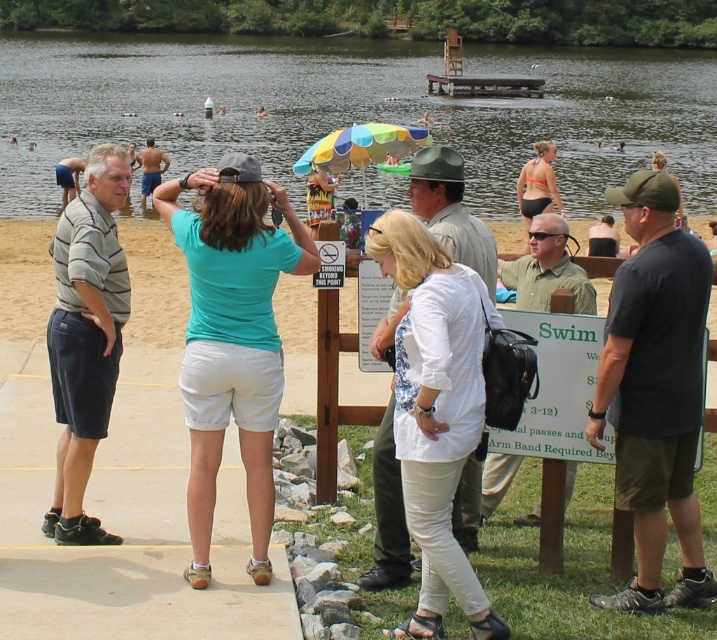
Does clear water at center have a greater height compared to striped polo shirt at center?

Correct, clear water at center is much taller as striped polo shirt at center.

Can you confirm if clear water at center is thinner than striped polo shirt at center?

Incorrect, clear water at center's width is not less than striped polo shirt at center's.

Which is behind, point (394, 108) or point (90, 317)?

Point (394, 108)

This screenshot has height=640, width=717. I want to click on clear water at center, so click(351, 109).

The image size is (717, 640). What do you see at coordinates (232, 339) in the screenshot? I see `teal fabric shirt at center` at bounding box center [232, 339].

The height and width of the screenshot is (640, 717). Describe the element at coordinates (232, 339) in the screenshot. I see `teal fabric shirt at center` at that location.

Identify the location of teal fabric shirt at center. Image resolution: width=717 pixels, height=640 pixels. (232, 339).

Who is more distant from viewer, (100, 216) or (143, 154)?

The point (143, 154) is behind.

Does striped polo shirt at center have a smaller size compared to matte blue shorts at center?

Yes.

Is point (94, 538) positioned before point (153, 186)?

That is True.

This screenshot has height=640, width=717. What are the coordinates of `striped polo shirt at center` in the screenshot? It's located at pos(85,337).